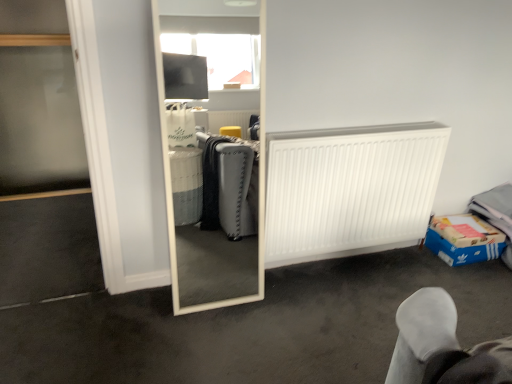
Question: Considering the positions of white matte mirror at center and blue cardboard box at lower right in the image, is white matte mirror at center bigger or smaller than blue cardboard box at lower right?

Choices:
 (A) small
 (B) big

Answer: (B)

Question: Considering the relative positions of white matte mirror at center and blue cardboard box at lower right in the image provided, is white matte mirror at center to the left or to the right of blue cardboard box at lower right?

Choices:
 (A) right
 (B) left

Answer: (B)

Question: Which is farther from the white matte mirror at center?

Choices:
 (A) blue cardboard box at lower right
 (B) white matte radiator at center right

Answer: (A)

Question: Which object is positioned closest to the white matte radiator at center right?

Choices:
 (A) white matte mirror at center
 (B) blue cardboard box at lower right

Answer: (A)